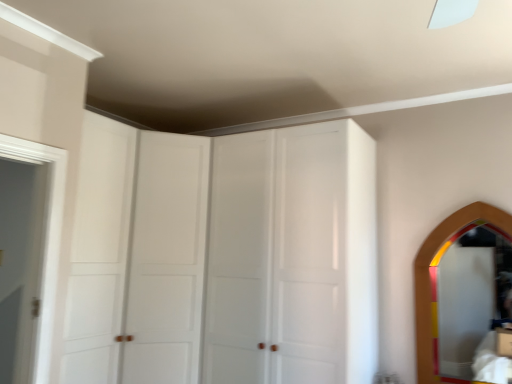
Question: From the image's perspective, would you say wooden mirror at right is shown under white wooden door at left?

Choices:
 (A) yes
 (B) no

Answer: (A)

Question: Does wooden mirror at right have a larger size compared to white wooden door at left?

Choices:
 (A) yes
 (B) no

Answer: (A)

Question: From the image's perspective, is wooden mirror at right located above white wooden door at left?

Choices:
 (A) yes
 (B) no

Answer: (B)

Question: Does wooden mirror at right appear on the right side of white wooden door at left?

Choices:
 (A) no
 (B) yes

Answer: (B)

Question: Is wooden mirror at right far from white wooden door at left?

Choices:
 (A) no
 (B) yes

Answer: (B)

Question: Relative to wooden mirror at right, is white glossy cabinet at center, positioned as the 2th glass door in left-to-right order, in front or behind?

Choices:
 (A) front
 (B) behind

Answer: (A)

Question: Is white glossy cabinet at center, arranged as the first glass door when viewed from the right, taller or shorter than wooden mirror at right?

Choices:
 (A) tall
 (B) short

Answer: (A)

Question: In terms of width, does white glossy cabinet at center, positioned as the 2th glass door in left-to-right order, look wider or thinner when compared to wooden mirror at right?

Choices:
 (A) thin
 (B) wide

Answer: (B)

Question: Is white glossy cabinet at center, positioned as the 2th glass door in left-to-right order, inside or outside of wooden mirror at right?

Choices:
 (A) inside
 (B) outside

Answer: (B)

Question: In terms of size, does wooden mirror at right appear bigger or smaller than white glossy cabinet at center, arranged as the first glass door when viewed from the right?

Choices:
 (A) big
 (B) small

Answer: (B)

Question: In the image, is wooden mirror at right on the left side or the right side of white glossy cabinet at center, arranged as the first glass door when viewed from the right?

Choices:
 (A) left
 (B) right

Answer: (B)

Question: Is point (486, 235) closer or farther from the camera than point (250, 213)?

Choices:
 (A) closer
 (B) farther

Answer: (A)

Question: From the image's perspective, is wooden mirror at right located above or below white glossy cabinet at center, arranged as the first glass door when viewed from the right?

Choices:
 (A) above
 (B) below

Answer: (B)

Question: Is white glossy cabinet doors at upper center, which is the second glass door from right to left, in front of or behind wooden mirror at right in the image?

Choices:
 (A) behind
 (B) front

Answer: (B)

Question: From the image's perspective, is white glossy cabinet doors at upper center, positioned as the first glass door in left-to-right order, above or below wooden mirror at right?

Choices:
 (A) above
 (B) below

Answer: (A)